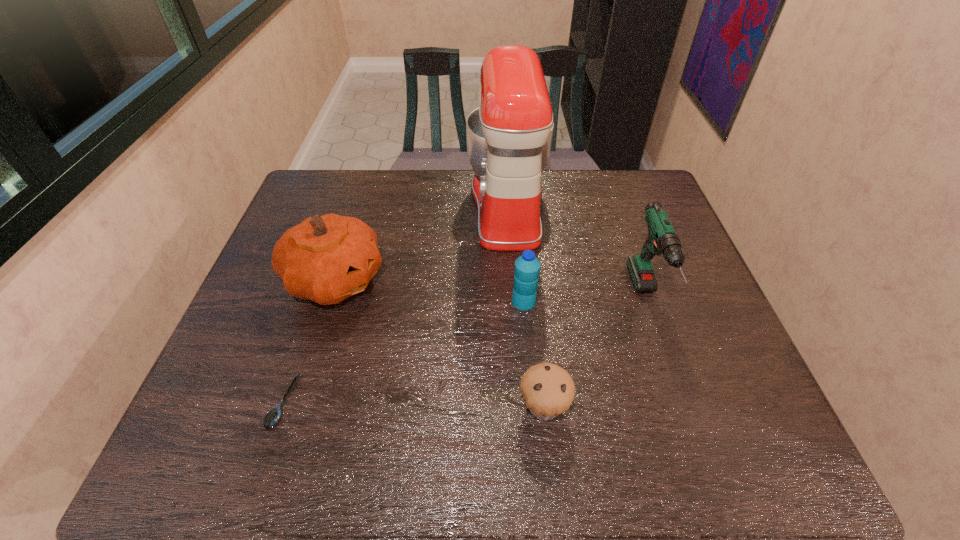
Image resolution: width=960 pixels, height=540 pixels. In order to click on mixer in this screenshot , I will do `click(509, 136)`.

At what (x,y) coordinates should I click in order to perform the action: click on drill. Please return your answer as a coordinate pair (x, y). The image size is (960, 540). Looking at the image, I should click on (662, 238).

At what (x,y) coordinates should I click in order to perform the action: click on pumpkin. Please return your answer as a coordinate pair (x, y). Looking at the image, I should click on (326, 259).

Identify the location of the third shortest object. (527, 267).

The image size is (960, 540). I want to click on the fifth tallest object, so click(x=548, y=390).

The height and width of the screenshot is (540, 960). Identify the location of soupspoon. (274, 415).

Image resolution: width=960 pixels, height=540 pixels. What are the coordinates of `vacant space located 0.390m on the front-facing side of the tallest object` in the screenshot? It's located at (344, 206).

Where is `vacant space positioned 0.070m on the front-facing side of the tallest object`? This screenshot has width=960, height=540. vacant space positioned 0.070m on the front-facing side of the tallest object is located at coordinates (445, 206).

The image size is (960, 540). Find the location of `free space located on the front-facing side of the tallest object`. free space located on the front-facing side of the tallest object is located at coordinates (348, 206).

The height and width of the screenshot is (540, 960). What are the coordinates of `free region located 0.230m on the handle side of the rightmost object` in the screenshot? It's located at (693, 432).